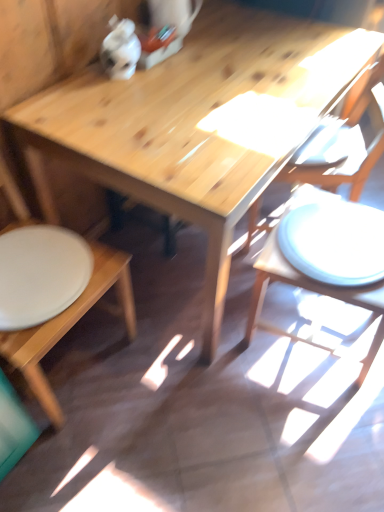
Question: Does wooden chair at right, placed as the first chair when sorted from right to left, have a greater height compared to white matte plate at lower left?

Choices:
 (A) yes
 (B) no

Answer: (A)

Question: From the image's perspective, is wooden chair at right, placed as the first chair when sorted from right to left, above white matte plate at lower left?

Choices:
 (A) yes
 (B) no

Answer: (A)

Question: Is wooden chair at right, the second chair positioned from the left, shorter than white matte plate at lower left?

Choices:
 (A) no
 (B) yes

Answer: (A)

Question: Is wooden chair at right, placed as the first chair when sorted from right to left, bigger than white matte plate at lower left?

Choices:
 (A) no
 (B) yes

Answer: (B)

Question: Is wooden chair at right, placed as the first chair when sorted from right to left, next to white matte plate at lower left?

Choices:
 (A) yes
 (B) no

Answer: (B)

Question: From the image's perspective, is wooden chair at right, placed as the first chair when sorted from right to left, below wooden table at center?

Choices:
 (A) yes
 (B) no

Answer: (B)

Question: Can we say wooden chair at right, placed as the first chair when sorted from right to left, lies outside wooden table at center?

Choices:
 (A) no
 (B) yes

Answer: (A)

Question: Does wooden chair at right, placed as the first chair when sorted from right to left, touch wooden table at center?

Choices:
 (A) no
 (B) yes

Answer: (A)

Question: Is wooden chair at right, placed as the first chair when sorted from right to left, far from wooden table at center?

Choices:
 (A) yes
 (B) no

Answer: (B)

Question: Is wooden chair at right, the second chair positioned from the left, positioned before wooden table at center?

Choices:
 (A) yes
 (B) no

Answer: (B)

Question: From the image's perspective, is wooden chair at right, placed as the first chair when sorted from right to left, located above wooden table at center?

Choices:
 (A) no
 (B) yes

Answer: (B)

Question: From a real-world perspective, is white matte plate at lower left positioned under wooden table at center based on gravity?

Choices:
 (A) yes
 (B) no

Answer: (B)